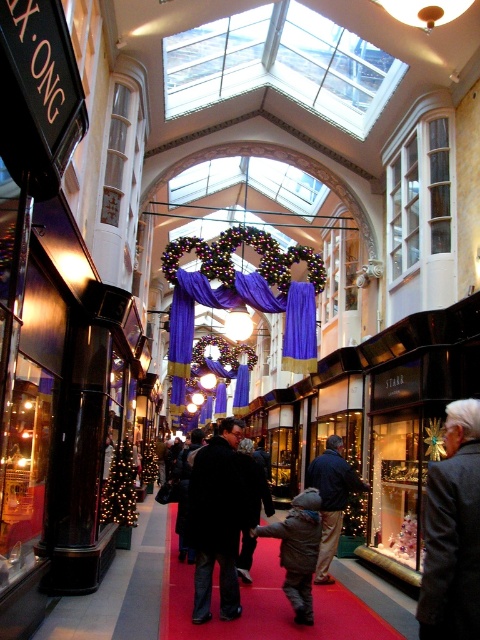
Is dark wool coat at center bigger than purple velvet curtain at center?

Indeed, dark wool coat at center has a larger size compared to purple velvet curtain at center.

The height and width of the screenshot is (640, 480). Describe the element at coordinates (218, 516) in the screenshot. I see `dark wool coat at center` at that location.

At what (x,y) coordinates should I click in order to perform the action: click on dark wool coat at center. Please return your answer as a coordinate pair (x, y). Looking at the image, I should click on (218, 516).

Which is above, dark wool coat at center or brown fuzzy coat at center?

dark wool coat at center is above.

Looking at this image, who is more forward, (208, 467) or (279, 564)?

Point (208, 467)

Locate an element on the screen. This screenshot has height=640, width=480. dark wool coat at center is located at coordinates (218, 516).

Is brown fuzzy coat at center taller than purple velvet curtain at center?

Yes, brown fuzzy coat at center is taller than purple velvet curtain at center.

Is brown fuzzy coat at center thinner than purple velvet curtain at center?

Incorrect, brown fuzzy coat at center's width is not less than purple velvet curtain at center's.

Which is in front, point (296, 621) or point (309, 362)?

Point (296, 621)

At what (x,y) coordinates should I click in order to perform the action: click on brown fuzzy coat at center. Please return your answer as a coordinate pair (x, y). Looking at the image, I should click on 298,550.